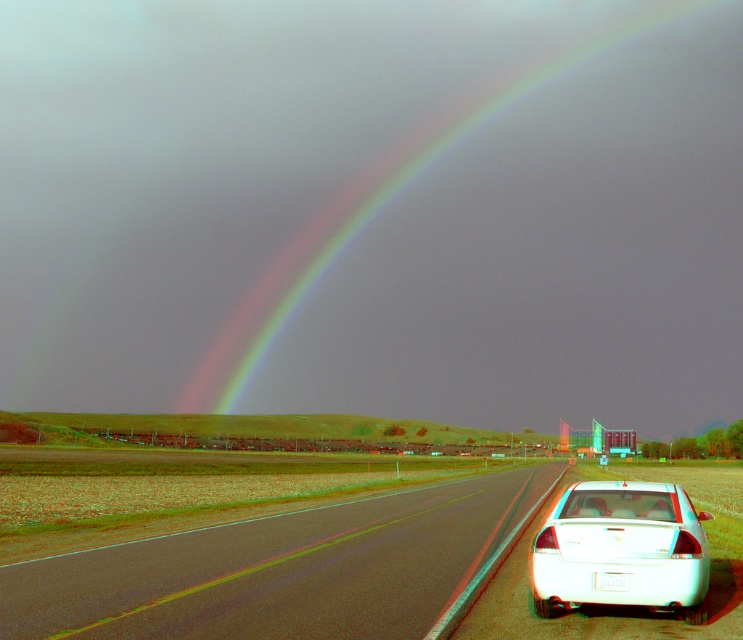
You are driving a car and see the rainbow at upper center and the asphalt road at lower right. Which object is positioned more to the right side of the image?

The rainbow at upper center is positioned more to the right side of the image than the asphalt road at lower right.